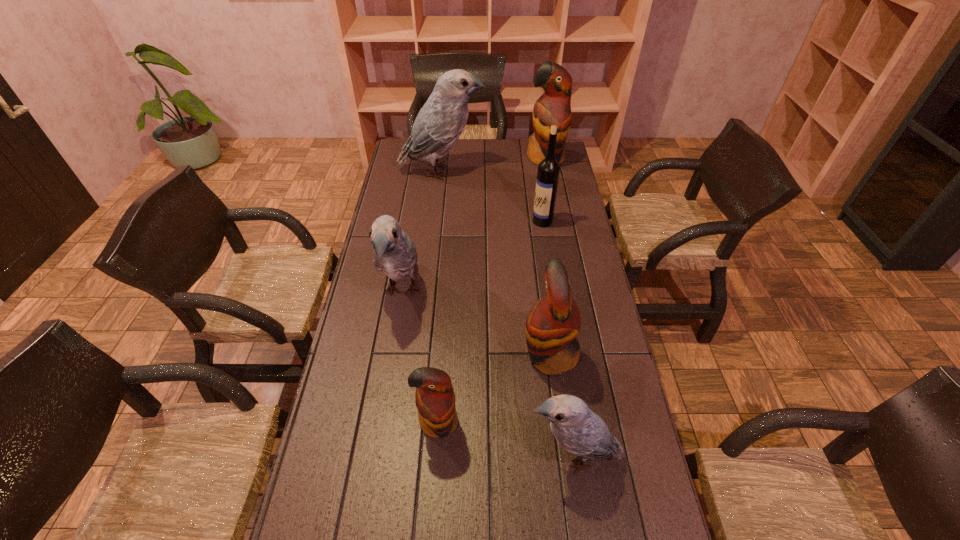
Locate which parrot ranks fourth in proximity to the biggest gray parrot. Please provide its 2D coordinates. Your answer should be formatted as a tuple, i.e. [(x, y)], where the tuple contains the x and y coordinates of a point satisfying the conditions above.

[(435, 399)]

Locate an element on the screen. parrot that can be found as the fourth closest to the farthest gray parrot is located at coordinates (435, 399).

Select which gray parrot is the closest to the biggest gray parrot. Please provide its 2D coordinates. Your answer should be formatted as a tuple, i.e. [(x, y)], where the tuple contains the x and y coordinates of a point satisfying the conditions above.

[(395, 255)]

Locate which gray parrot is the closest to the fourth nearest object. Please provide its 2D coordinates. Your answer should be formatted as a tuple, i.e. [(x, y)], where the tuple contains the x and y coordinates of a point satisfying the conditions above.

[(578, 430)]

Locate which red parrot is the second closest to the biggest red parrot. Please provide its 2D coordinates. Your answer should be formatted as a tuple, i.e. [(x, y)], where the tuple contains the x and y coordinates of a point satisfying the conditions above.

[(435, 399)]

Locate an element on the screen. The width and height of the screenshot is (960, 540). red parrot that is the second closest to the farthest gray parrot is located at coordinates (553, 323).

Image resolution: width=960 pixels, height=540 pixels. What are the coordinates of `vacant area that satisfies the following two spatial constraints: 1. on the face of the farthest red parrot; 2. on the label of the third farthest object` in the screenshot? It's located at (558, 221).